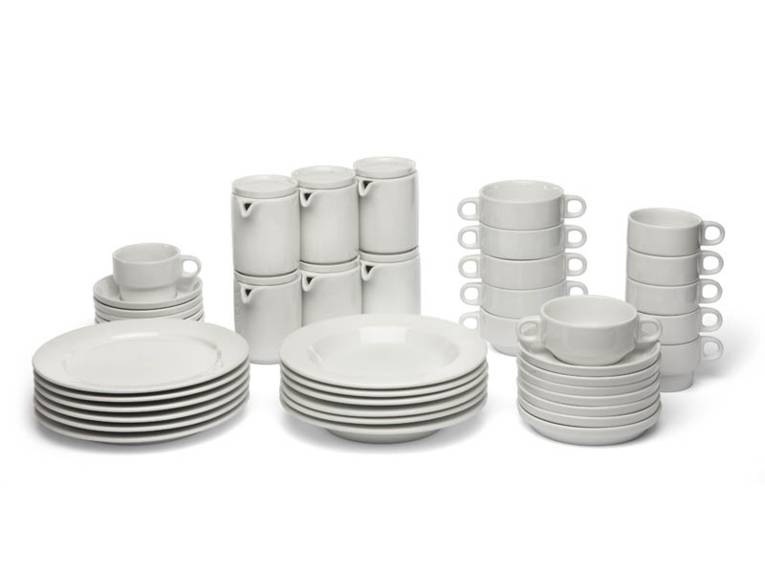
Image resolution: width=765 pixels, height=574 pixels. I want to click on cups, so click(684, 370), click(679, 338), click(676, 301), click(674, 272), click(674, 241), click(145, 270).